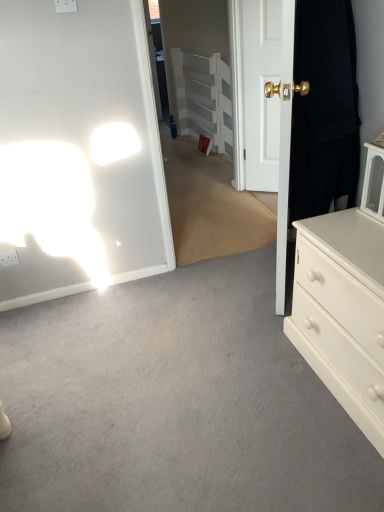
Question: Considering the positions of point (256, 55) and point (188, 83), is point (256, 55) closer or farther from the camera than point (188, 83)?

Choices:
 (A) closer
 (B) farther

Answer: (A)

Question: Is white glossy door at center, arranged as the 2th door when viewed from the front, in front of or behind white painted wood armoire at center in the image?

Choices:
 (A) front
 (B) behind

Answer: (A)

Question: Which is farther from the white matte chest of drawers at right?

Choices:
 (A) clear glass door at center
 (B) white glossy door at center, arranged as the first door when viewed from the back
 (C) white painted wood armoire at center
 (D) black fabric door at right, acting as the first door starting from the front

Answer: (C)

Question: Estimate the real-world distances between objects in this image. Which object is closer to the clear glass door at center?

Choices:
 (A) white matte chest of drawers at right
 (B) white painted wood armoire at center
 (C) white glossy door at center, arranged as the first door when viewed from the back
 (D) black fabric door at right, acting as the first door starting from the front

Answer: (B)